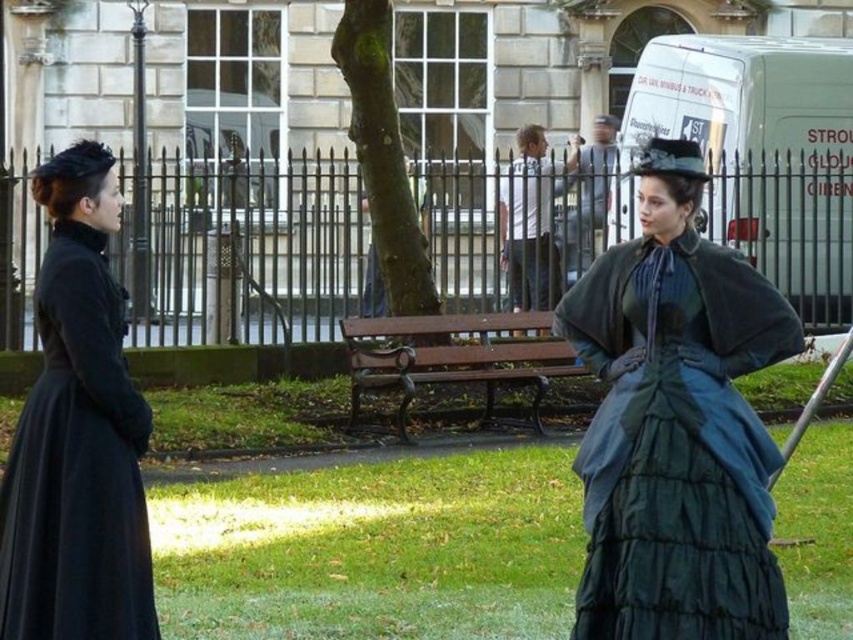
Between wooden bench at center and light gray shirt at center, which one is positioned higher?

light gray shirt at center is higher up.

Is wooden bench at center taller than light gray shirt at center?

Yes, wooden bench at center is taller than light gray shirt at center.

At what (x,y) coordinates should I click in order to perform the action: click on wooden bench at center. Please return your answer as a coordinate pair (x, y). The height and width of the screenshot is (640, 853). Looking at the image, I should click on (456, 356).

The height and width of the screenshot is (640, 853). What are the coordinates of `wooden bench at center` in the screenshot? It's located at (456, 356).

Is velvet teal dress at center taller than matte black dress at left?

Yes, velvet teal dress at center is taller than matte black dress at left.

Looking at this image, does velvet teal dress at center have a greater width compared to matte black dress at left?

Indeed, velvet teal dress at center has a greater width compared to matte black dress at left.

Is point (630, 266) positioned in front of point (1, 593)?

No, it is not.

Locate an element on the screen. velvet teal dress at center is located at coordinates (676, 424).

Is matte black dress at left above light gray shirt at center?

No.

Between matte black dress at left and light gray shirt at center, which one has more height?

matte black dress at left

I want to click on matte black dress at left, so click(x=77, y=465).